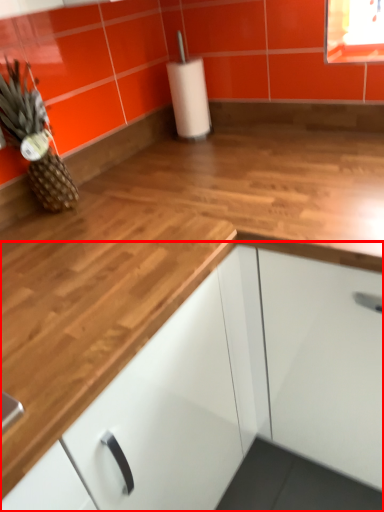
Question: From the image's perspective, considering the relative positions of cabinetry (annotated by the red box) and pineapple in the image provided, where is cabinetry (annotated by the red box) located with respect to the staircase?

Choices:
 (A) above
 (B) below

Answer: (B)